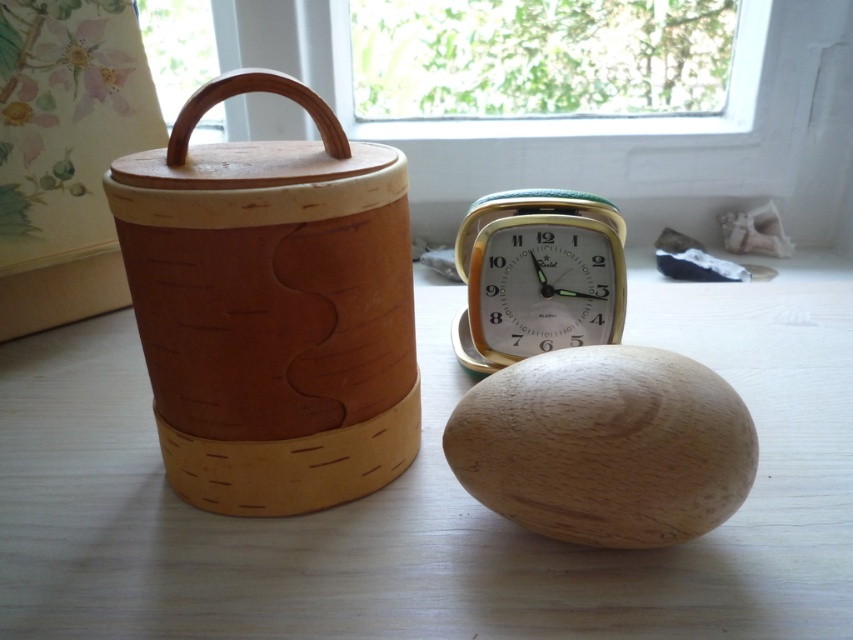
Question: Is natural wood table at center to the left of metallic gold alarm clock at center from the viewer's perspective?

Choices:
 (A) yes
 (B) no

Answer: (B)

Question: Considering the relative positions of natural wood table at center and metallic gold alarm clock at center in the image provided, where is natural wood table at center located with respect to metallic gold alarm clock at center?

Choices:
 (A) below
 (B) above

Answer: (A)

Question: Is natural wood table at center in front of metallic gold alarm clock at center?

Choices:
 (A) no
 (B) yes

Answer: (B)